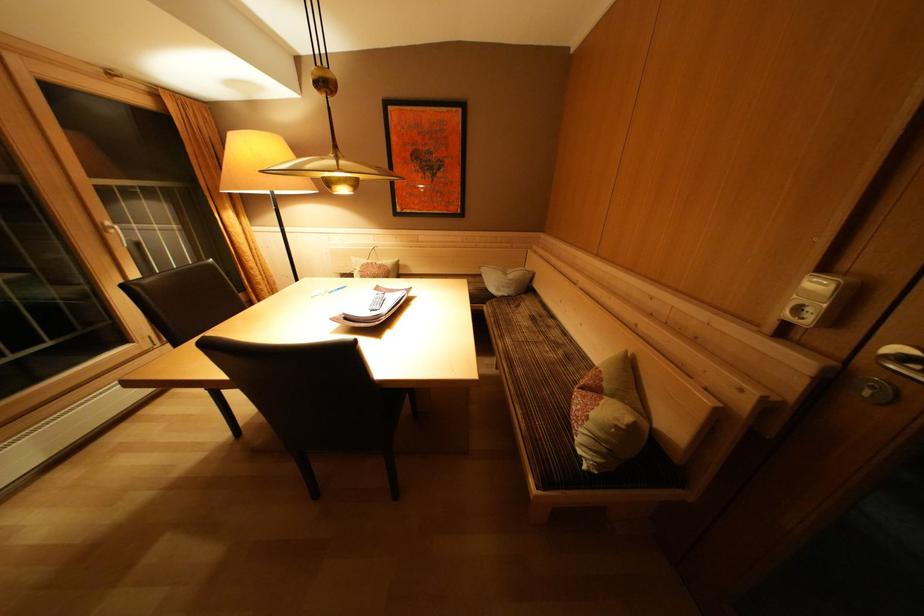
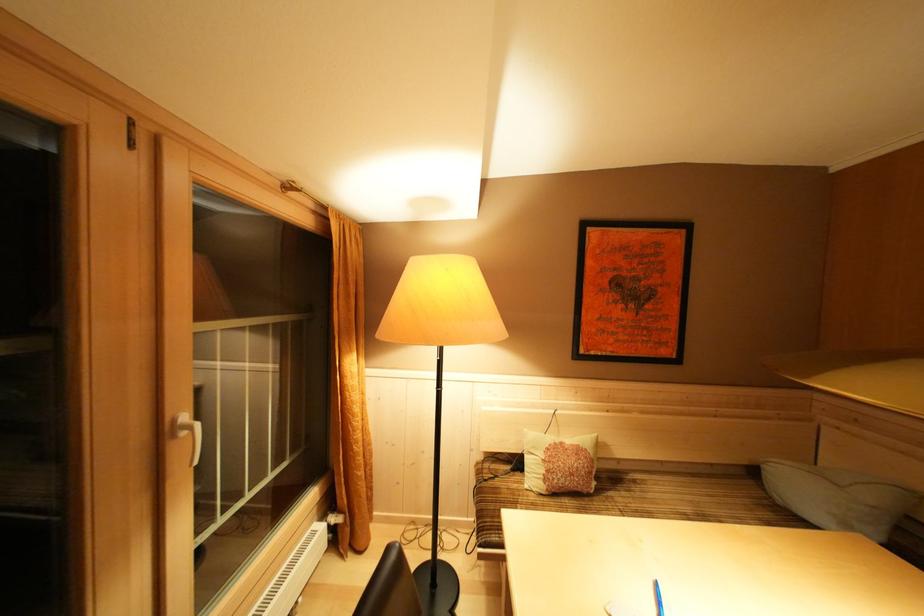
Where in the second image is the point corresponding to [233,214] from the first image?

(358, 357)